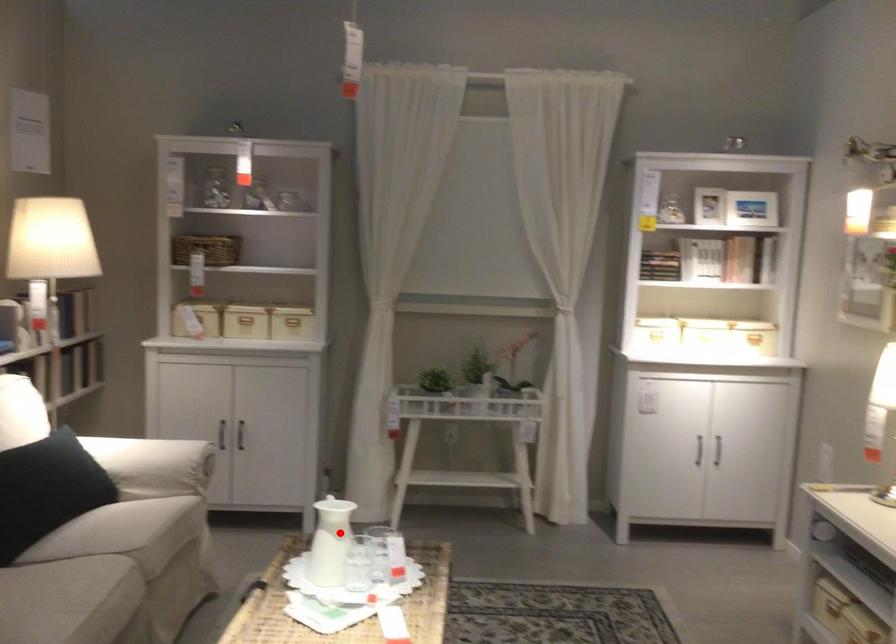
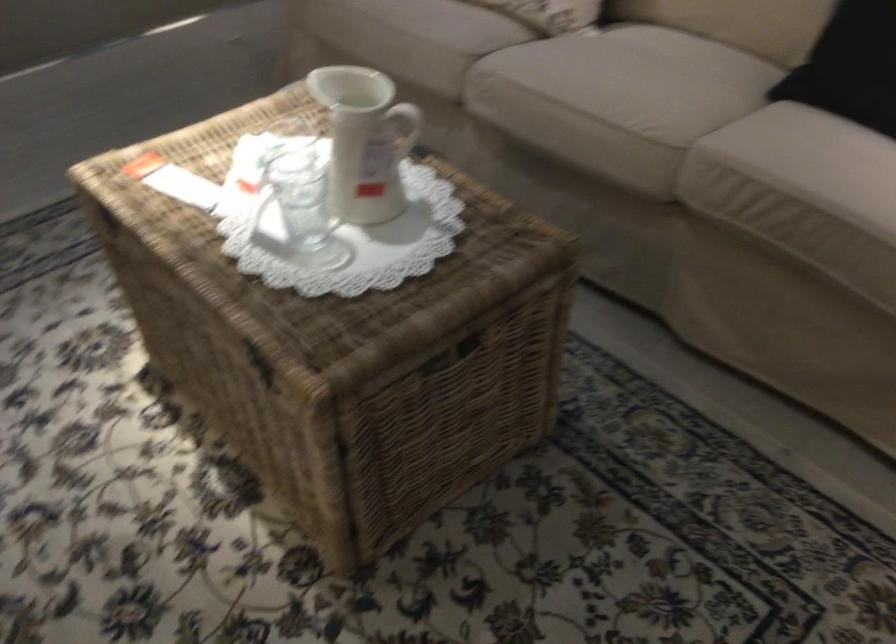
Find the pixel in the second image that matches the highlighted location in the first image.

(365, 140)